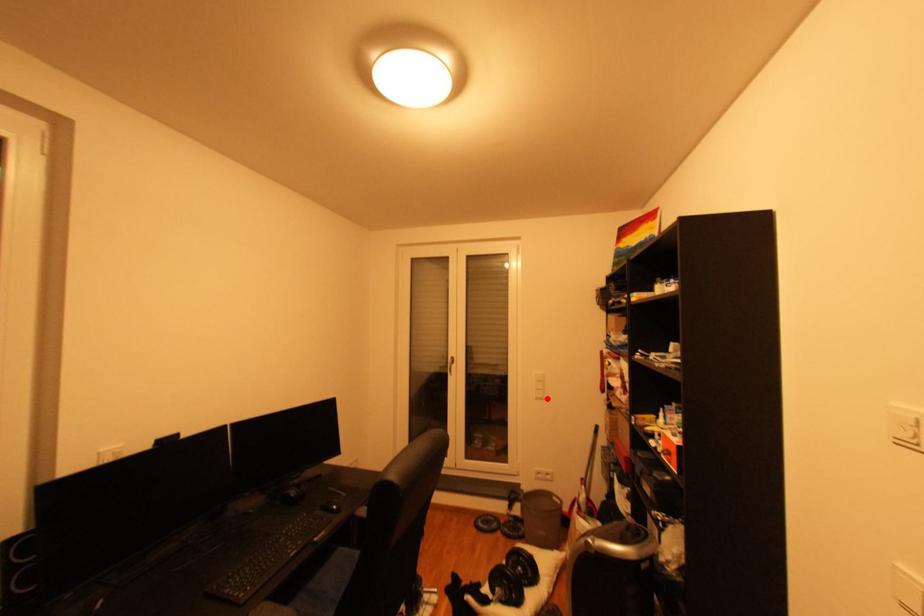
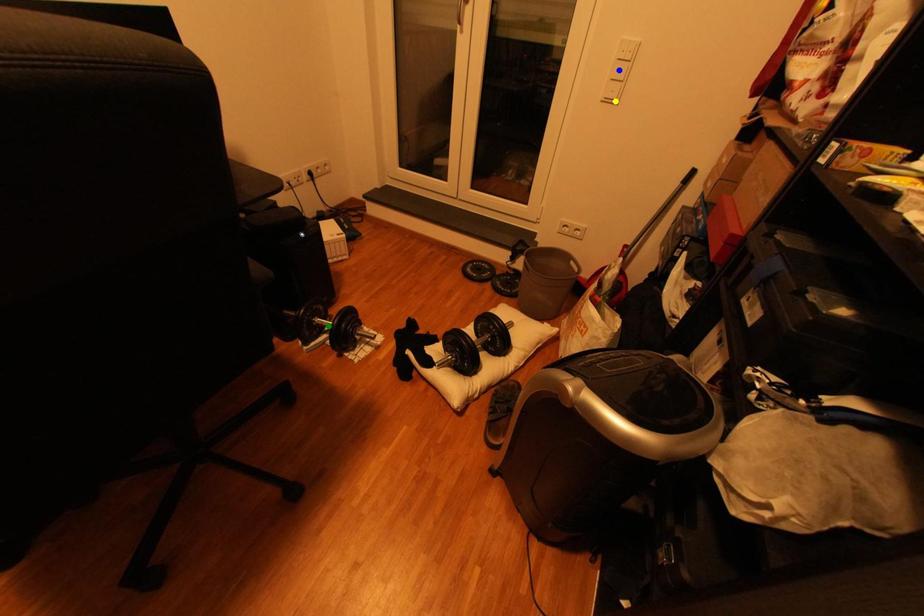
Question: I am providing you with two images of the same scene from different viewpoints. A red point is marked on the first image. You are given multiple points on the second image. Which point in image 2 represents the same 3d spot as the red point in image 1?

Choices:
 (A) green point
 (B) yellow point
 (C) blue point

Answer: (B)